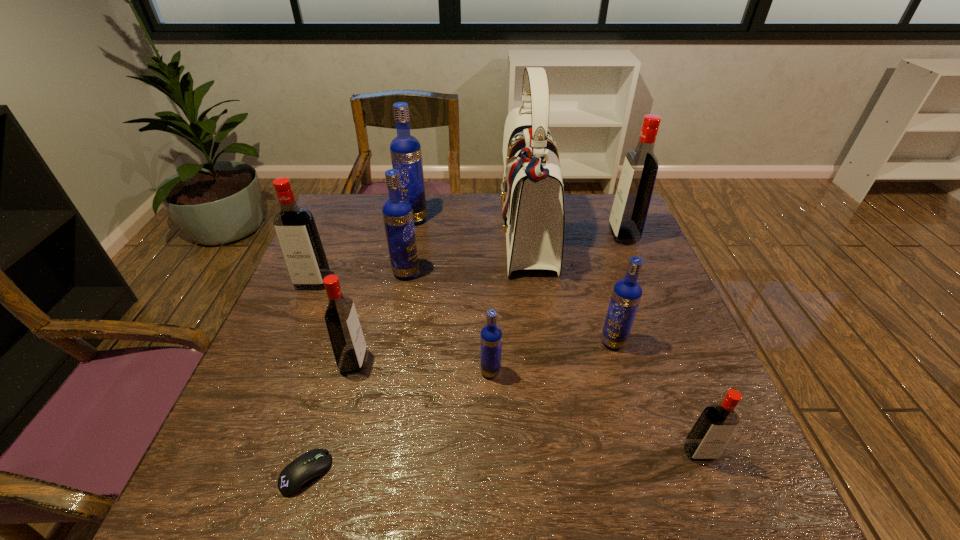
Image resolution: width=960 pixels, height=540 pixels. Identify the location of satchel. (532, 196).

The width and height of the screenshot is (960, 540). I want to click on the tallest object, so click(532, 196).

At what (x,y) coordinates should I click in order to perform the action: click on the biggest red vodka. Please return your answer as a coordinate pair (x, y). The height and width of the screenshot is (540, 960). Looking at the image, I should click on (633, 195).

Identify the location of the farthest blue vodka. (406, 156).

This screenshot has height=540, width=960. Identify the location of the second biggest blue vodka. [x=397, y=212].

The height and width of the screenshot is (540, 960). I want to click on the leftmost red vodka, so click(295, 227).

This screenshot has height=540, width=960. I want to click on the second farthest red vodka, so click(295, 227).

Where is `the eighth object from left to right`? This screenshot has height=540, width=960. the eighth object from left to right is located at coordinates [626, 295].

At what (x,y) coordinates should I click in order to perform the action: click on the sixth vodka from left to right. Please return your answer as a coordinate pair (x, y). Looking at the image, I should click on (626, 295).

Image resolution: width=960 pixels, height=540 pixels. I want to click on the second red vodka from left to right, so click(x=349, y=347).